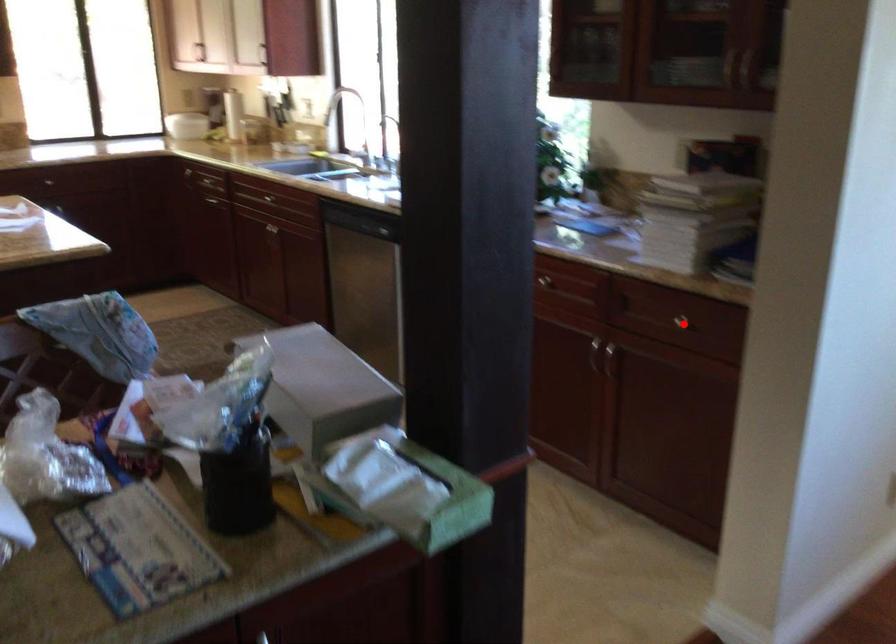
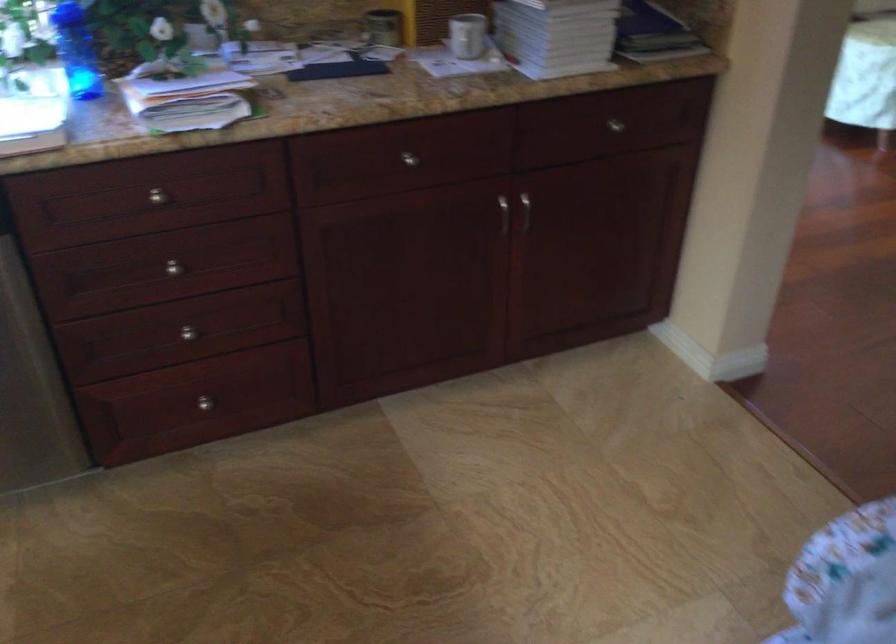
Question: I am providing you with two images of the same scene from different viewpoints. In image1, a red point is highlighted. Considering the same 3D point in image2, which of the following is correct?

Choices:
 (A) It is closer
 (B) It is farther

Answer: (A)